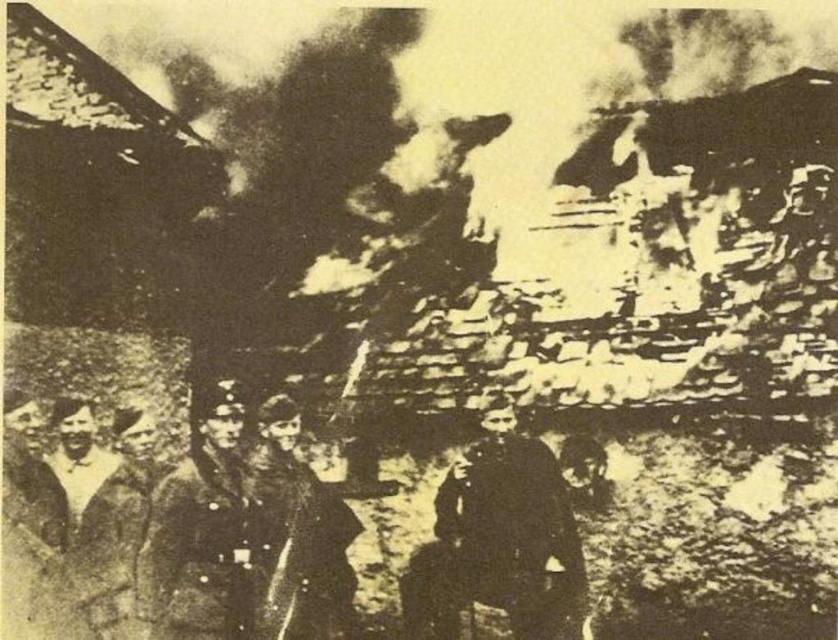
Can you confirm if dark gray fur coat at center is positioned below dark gray wool coat at lower left?

Incorrect, dark gray fur coat at center is not positioned below dark gray wool coat at lower left.

Who is more distant from viewer, (282, 608) or (102, 541)?

The point (102, 541) is behind.

Between point (350, 538) and point (55, 412), which one is positioned behind?

The point (350, 538) is more distant.

Where is `dark gray fur coat at center`? The width and height of the screenshot is (838, 640). dark gray fur coat at center is located at coordinates [x=303, y=538].

Between dark gray wool coat at center and dark gray fur coat at center, which one appears on the right side from the viewer's perspective?

dark gray wool coat at center is more to the right.

From the picture: Does dark gray wool coat at center have a greater width compared to dark gray fur coat at center?

Correct, the width of dark gray wool coat at center exceeds that of dark gray fur coat at center.

Where is `dark gray wool coat at center`? The height and width of the screenshot is (640, 838). dark gray wool coat at center is located at coordinates (499, 540).

Does dark gray wool coat at center come in front of dark gray wool coat at lower left?

No, it is behind dark gray wool coat at lower left.

Can you confirm if dark gray wool coat at center is taller than dark gray wool coat at lower left?

Yes, dark gray wool coat at center is taller than dark gray wool coat at lower left.

Where is `dark gray wool coat at center`? This screenshot has width=838, height=640. dark gray wool coat at center is located at coordinates (499, 540).